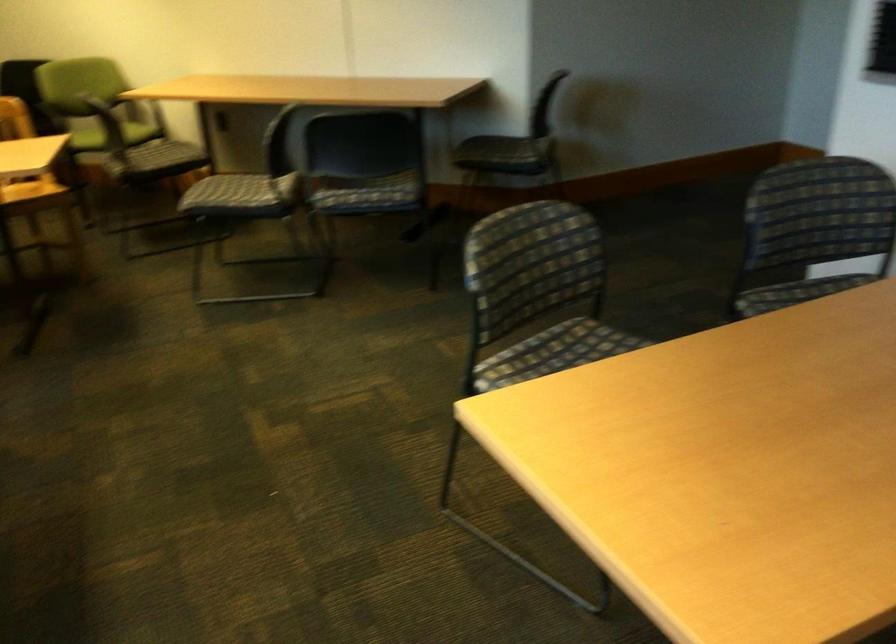
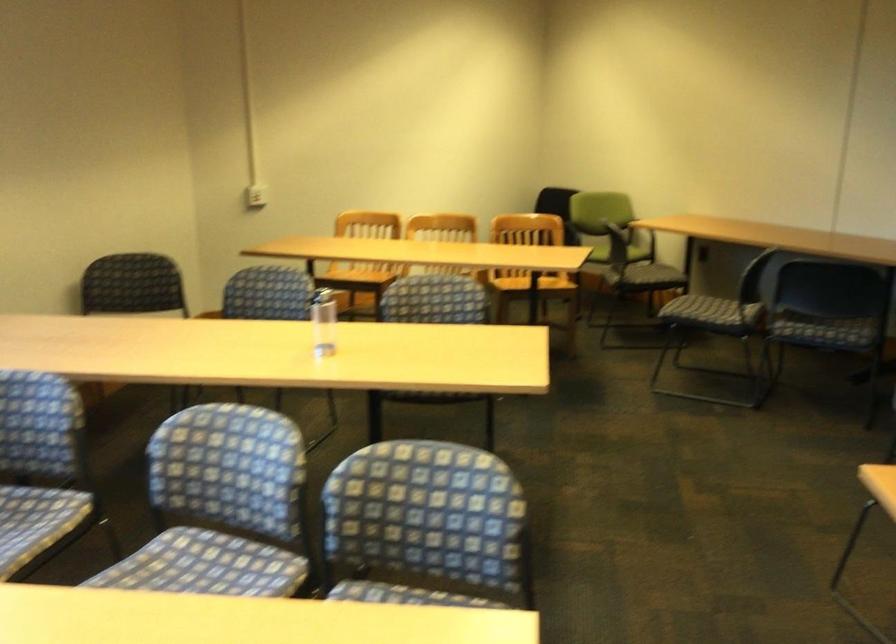
Locate, in the second image, the point that corresponds to [253,211] in the first image.

(721, 316)